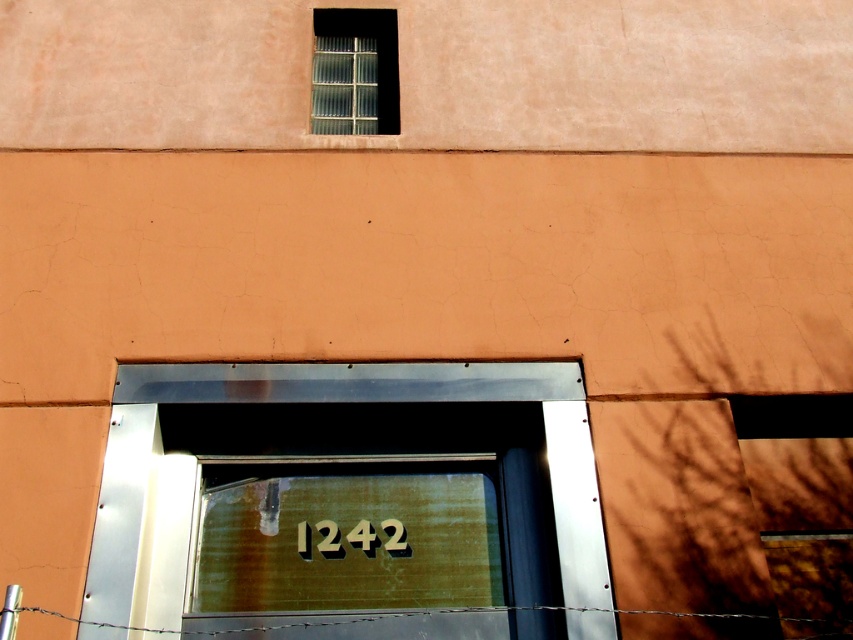
Between wooden sign at center and barbed wire at bottom, which one is positioned lower?

barbed wire at bottom is below.

Looking at this image, can you confirm if wooden sign at center is shorter than barbed wire at bottom?

In fact, wooden sign at center may be taller than barbed wire at bottom.

Is point (303, 540) closer to camera compared to point (622, 611)?

No.

The image size is (853, 640). I want to click on wooden sign at center, so click(320, 540).

Can you confirm if clear glass window at upper center is thinner than wooden sign at center?

Yes, clear glass window at upper center is thinner than wooden sign at center.

What do you see at coordinates (355, 72) in the screenshot?
I see `clear glass window at upper center` at bounding box center [355, 72].

Where is `clear glass window at upper center`? The height and width of the screenshot is (640, 853). clear glass window at upper center is located at coordinates (355, 72).

Does clear glass window at upper center appear over barbed wire at bottom?

Correct, clear glass window at upper center is located above barbed wire at bottom.

Can you confirm if clear glass window at upper center is taller than barbed wire at bottom?

Yes.

Image resolution: width=853 pixels, height=640 pixels. Identify the location of clear glass window at upper center. (355, 72).